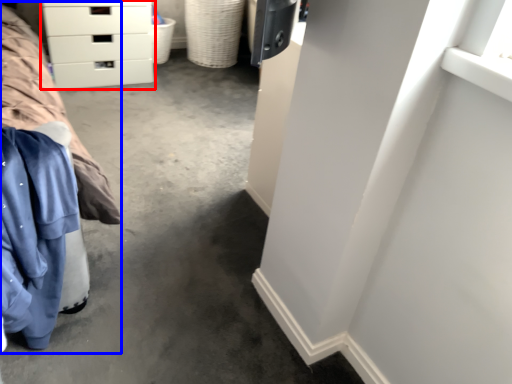
Question: Among these objects, which one is nearest to the camera, chest of drawers (highlighted by a red box) or bed (highlighted by a blue box)?

Choices:
 (A) chest of drawers
 (B) bed

Answer: (B)